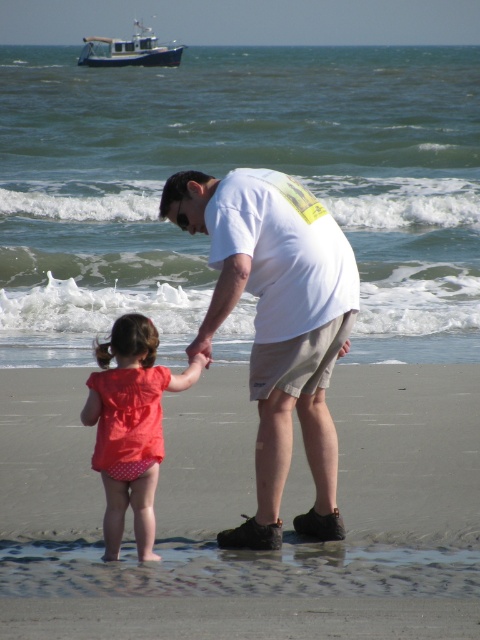
Question: Which is farther from the wooden boat at upper left?

Choices:
 (A) white matte shirt at center
 (B) polka dot fabric swimsuit at lower left

Answer: (B)

Question: Does white matte shirt at center have a larger size compared to wooden boat at upper left?

Choices:
 (A) yes
 (B) no

Answer: (B)

Question: Which object is farther from the camera taking this photo?

Choices:
 (A) wooden boat at upper left
 (B) white matte shirt at center
 (C) smooth tan sand at lower center
 (D) polka dot fabric swimsuit at lower left

Answer: (A)

Question: Among these objects, which one is farthest from the camera?

Choices:
 (A) white matte shirt at center
 (B) smooth tan sand at lower center
 (C) polka dot fabric swimsuit at lower left

Answer: (B)

Question: Is white matte shirt at center positioned behind wooden boat at upper left?

Choices:
 (A) no
 (B) yes

Answer: (A)

Question: Is smooth tan sand at lower center above polka dot fabric swimsuit at lower left?

Choices:
 (A) yes
 (B) no

Answer: (B)